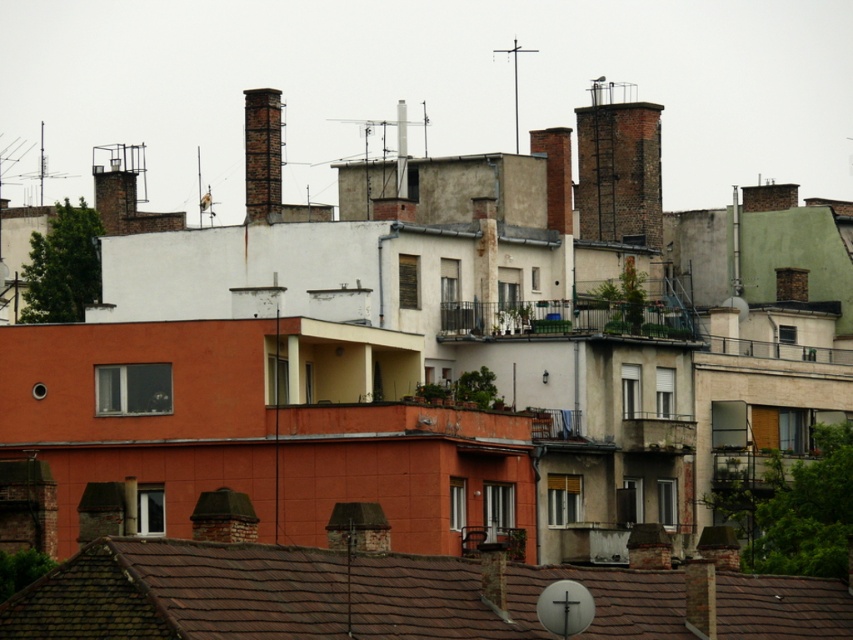
Question: Which of the following is the closest to the observer?

Choices:
 (A) (663, 628)
 (B) (253, 150)

Answer: (A)

Question: Among these objects, which one is farthest from the camera?

Choices:
 (A) brick chimney at upper center
 (B) brown tile roof at lower center

Answer: (A)

Question: Is brown tile roof at lower center to the right of brick chimney at upper center from the viewer's perspective?

Choices:
 (A) no
 (B) yes

Answer: (B)

Question: Is brown tile roof at lower center further to camera compared to brick chimney at upper center?

Choices:
 (A) yes
 (B) no

Answer: (B)

Question: Which point appears closest to the camera in this image?

Choices:
 (A) (363, 609)
 (B) (250, 193)

Answer: (A)

Question: Does brown tile roof at lower center appear under brick chimney at upper center?

Choices:
 (A) no
 (B) yes

Answer: (B)